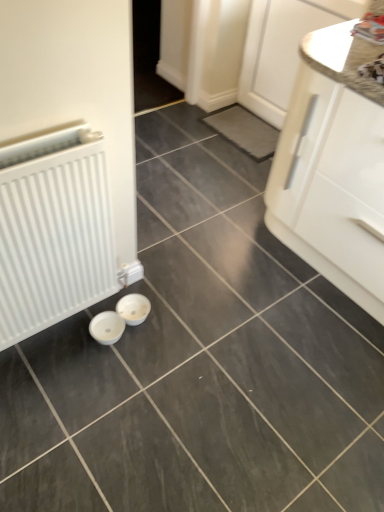
Question: Does white glossy cabinet at right, marked as the second cabinetry in a top-to-bottom arrangement, touch white glossy cabinet at upper right, which appears as the first cabinetry when viewed from the top?

Choices:
 (A) yes
 (B) no

Answer: (B)

Question: Are white glossy cabinet at right, marked as the second cabinetry in a top-to-bottom arrangement, and white glossy cabinet at upper right, which appears as the first cabinetry when viewed from the top, far apart?

Choices:
 (A) no
 (B) yes

Answer: (A)

Question: Considering the relative positions of white glossy cabinet at right, the 1th cabinetry when ordered from bottom to top, and white glossy cabinet at upper right, which appears as the first cabinetry when viewed from the top, in the image provided, is white glossy cabinet at right, the 1th cabinetry when ordered from bottom to top, to the right of white glossy cabinet at upper right, which appears as the first cabinetry when viewed from the top, from the viewer's perspective?

Choices:
 (A) no
 (B) yes

Answer: (B)

Question: From the image's perspective, is white glossy cabinet at right, the 1th cabinetry when ordered from bottom to top, on top of white glossy cabinet at upper right, the 2th cabinetry when ordered from bottom to top?

Choices:
 (A) no
 (B) yes

Answer: (A)

Question: Would you say white glossy cabinet at right, marked as the second cabinetry in a top-to-bottom arrangement, is outside white glossy cabinet at upper right, the 2th cabinetry when ordered from bottom to top?

Choices:
 (A) no
 (B) yes

Answer: (B)

Question: From a real-world perspective, is white glossy cabinet at right, the 1th cabinetry when ordered from bottom to top, on top of white glossy cabinet at upper right, the 2th cabinetry when ordered from bottom to top?

Choices:
 (A) yes
 (B) no

Answer: (A)

Question: Is white glossy cabinet at right, marked as the second cabinetry in a top-to-bottom arrangement, closer to camera compared to white matte radiator at left?

Choices:
 (A) no
 (B) yes

Answer: (A)

Question: Is white glossy cabinet at right, marked as the second cabinetry in a top-to-bottom arrangement, looking in the opposite direction of white matte radiator at left?

Choices:
 (A) yes
 (B) no

Answer: (B)

Question: Does white glossy cabinet at right, the 1th cabinetry when ordered from bottom to top, come behind white matte radiator at left?

Choices:
 (A) yes
 (B) no

Answer: (A)

Question: From the image's perspective, is white glossy cabinet at right, the 1th cabinetry when ordered from bottom to top, over white matte radiator at left?

Choices:
 (A) no
 (B) yes

Answer: (B)

Question: Is white glossy cabinet at right, marked as the second cabinetry in a top-to-bottom arrangement, wider than white matte radiator at left?

Choices:
 (A) yes
 (B) no

Answer: (A)

Question: Does white glossy cabinet at right, marked as the second cabinetry in a top-to-bottom arrangement, turn towards white matte radiator at left?

Choices:
 (A) yes
 (B) no

Answer: (A)

Question: Is white matte radiator at left taller than white glossy cabinet at upper right, which appears as the first cabinetry when viewed from the top?

Choices:
 (A) no
 (B) yes

Answer: (A)